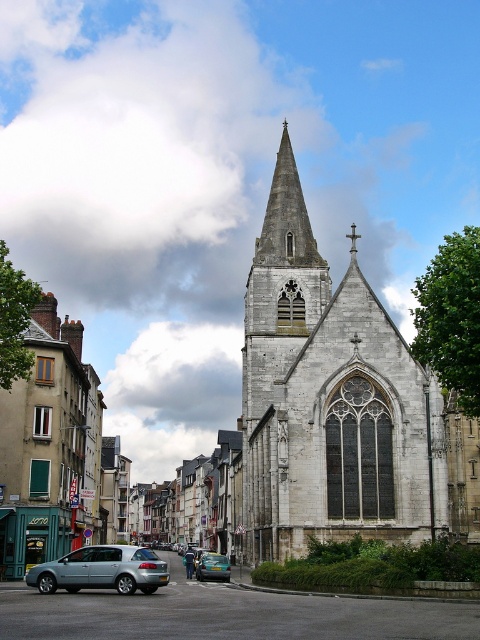
Question: Among these objects, which one is farthest from the camera?

Choices:
 (A) metallic blue sedan at center
 (B) light blue metallic hatchback at lower left
 (C) stone church at center

Answer: (A)

Question: Is gray stone church at center to the right of metallic blue sedan at center from the viewer's perspective?

Choices:
 (A) yes
 (B) no

Answer: (A)

Question: Which of the following is the farthest from the observer?

Choices:
 (A) metallic blue sedan at center
 (B) light blue metallic hatchback at lower left

Answer: (A)

Question: Is stone church at center positioned before gray stone church at center?

Choices:
 (A) no
 (B) yes

Answer: (A)

Question: Where is stone church at center located in relation to gray stone church at center in the image?

Choices:
 (A) below
 (B) above

Answer: (A)

Question: Estimate the real-world distances between objects in this image. Which object is farther from the metallic blue sedan at center?

Choices:
 (A) light blue metallic hatchback at lower left
 (B) stone church at center
 (C) gray stone church at center

Answer: (B)